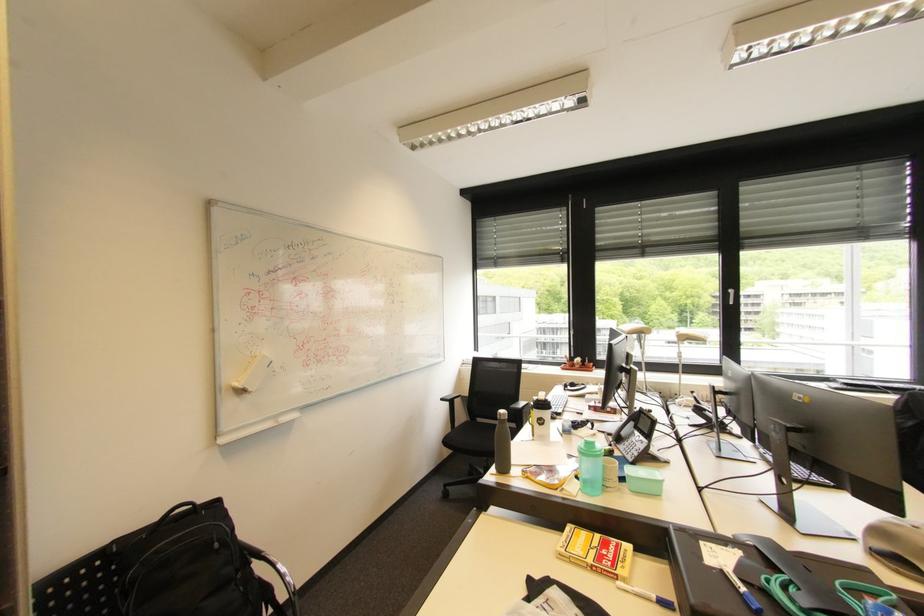
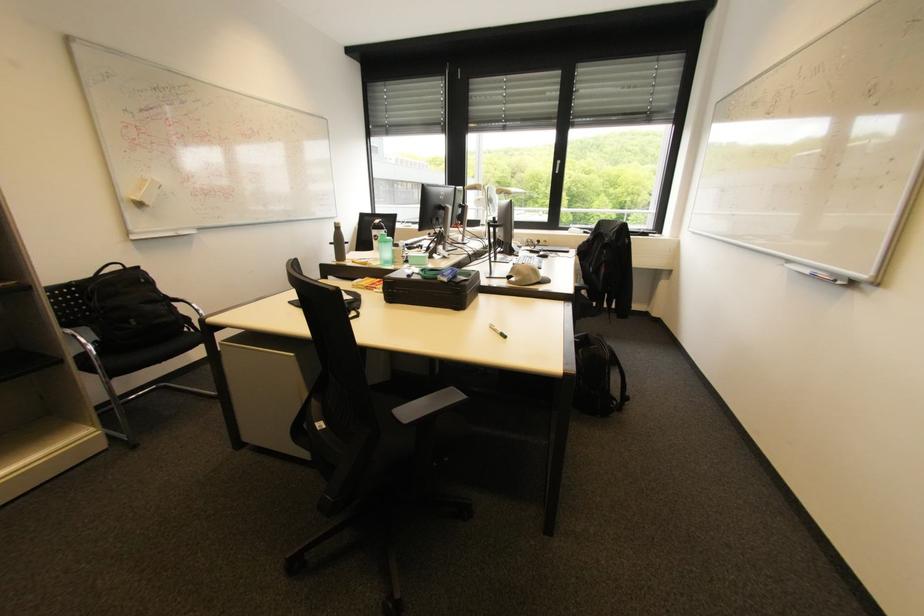
Find the pixel in the second image that matches (446,400) in the first image.

(335, 244)